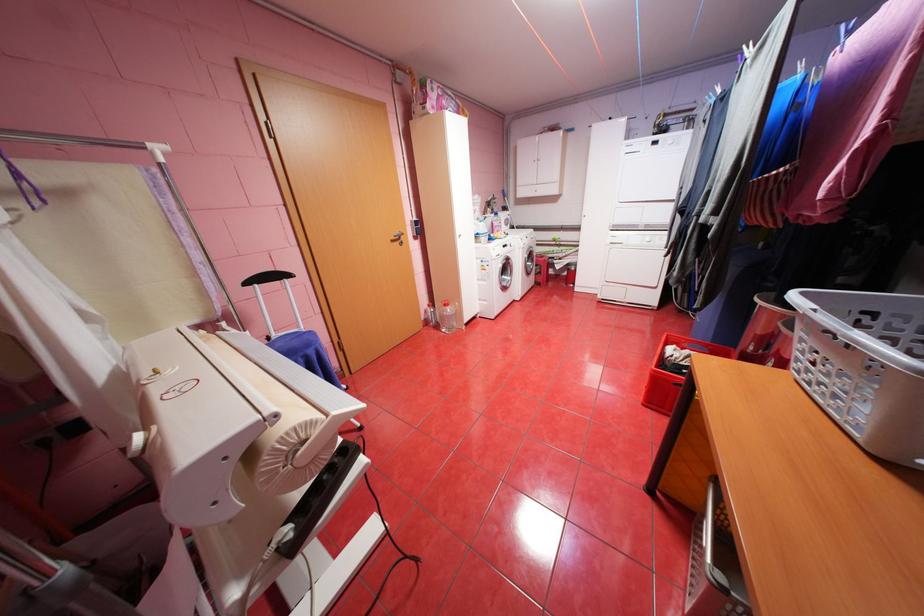
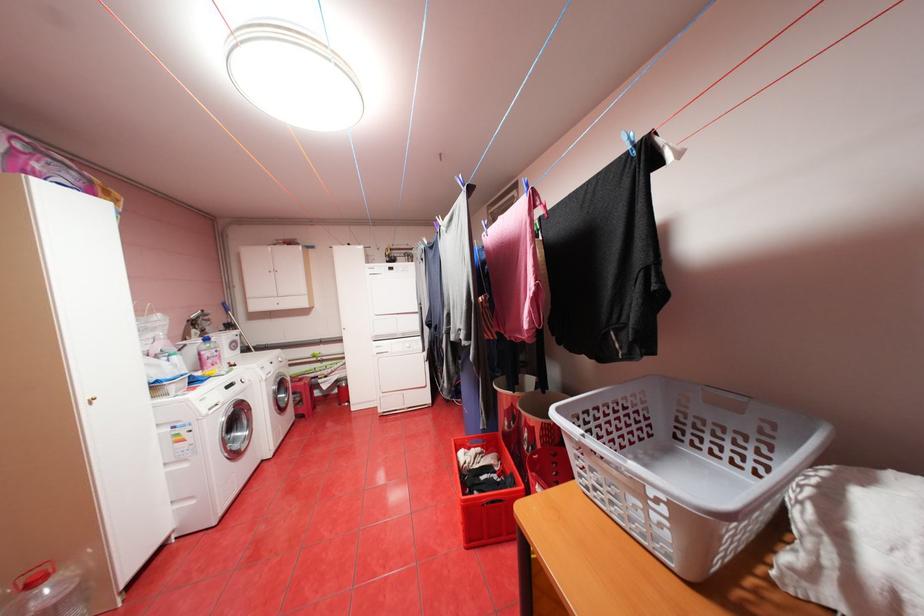
Locate, in the second image, the point that corresponds to point 535,265 in the first image.

(286, 400)